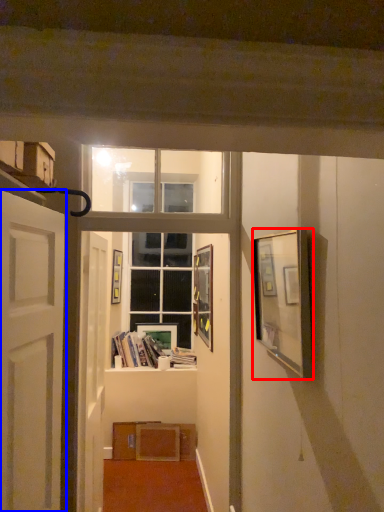
Question: Which object is further to the camera taking this photo, picture frame (highlighted by a red box) or door (highlighted by a blue box)?

Choices:
 (A) picture frame
 (B) door

Answer: (A)